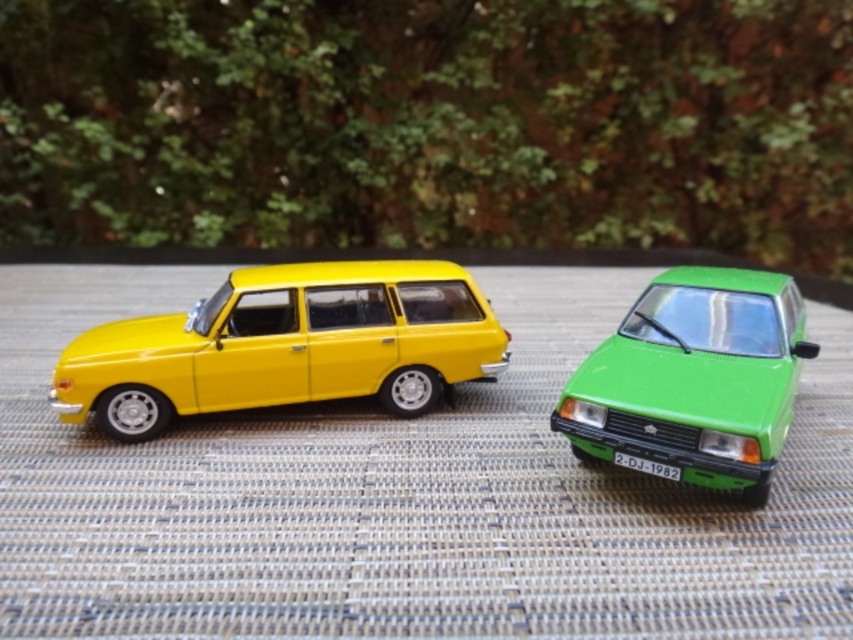
Question: Does matte yellow station wagon at center appear over green matte car at center?

Choices:
 (A) no
 (B) yes

Answer: (B)

Question: Which of the following is the closest to the observer?

Choices:
 (A) (349, 262)
 (B) (793, 317)

Answer: (B)

Question: Which of the following is the closest to the observer?

Choices:
 (A) (453, 296)
 (B) (680, 436)

Answer: (B)

Question: Is matte yellow station wagon at center below green matte car at center?

Choices:
 (A) no
 (B) yes

Answer: (A)

Question: Is matte yellow station wagon at center above green matte car at center?

Choices:
 (A) no
 (B) yes

Answer: (B)